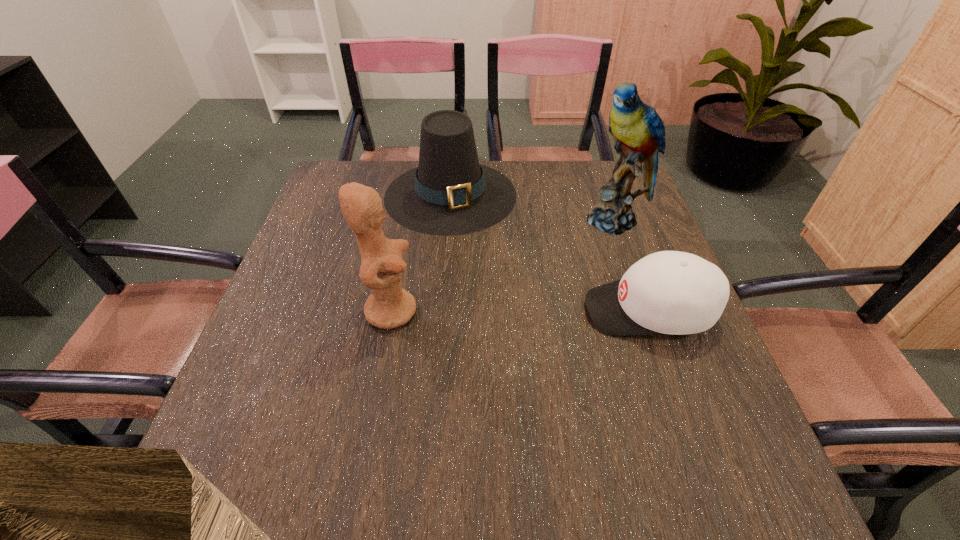
In order to click on free spot on the desktop that is between the second tallest object and the shortest object and is positioned on the face of the parrot in this screenshot , I will do `click(547, 310)`.

Locate an element on the screen. The height and width of the screenshot is (540, 960). free space on the desktop that is between the third shortest object and the baseball cap and is positioned on the front-facing side of the hat is located at coordinates (483, 310).